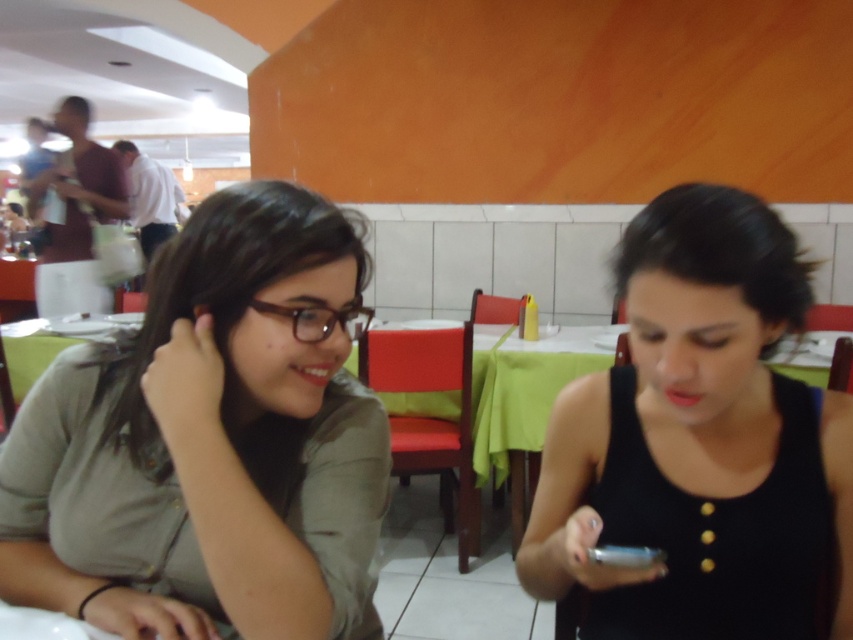
You are a fashion designer observing the two outfits in the image. The matte green shirt at left and the black matte tank top at center are part of a collection. Which one has a shorter length?

The matte green shirt at left is shorter than the black matte tank top at center.

You are a photographer standing at a distance of 26.80 inches from the matte green shirt at left. You want to take a photo of the person wearing it. Is the distance sufficient to capture their entire upper body in the frame?

The distance between the matte green shirt at left and the viewer is 26.80 inches, which is sufficient to capture the entire upper body in the frame.

From the picture: You are a fashion designer observing two outfits in the image. The matte green shirt at left and the black matte tank top at center. Which one has a larger size?

The matte green shirt at left has a larger size compared to the black matte tank top at center.